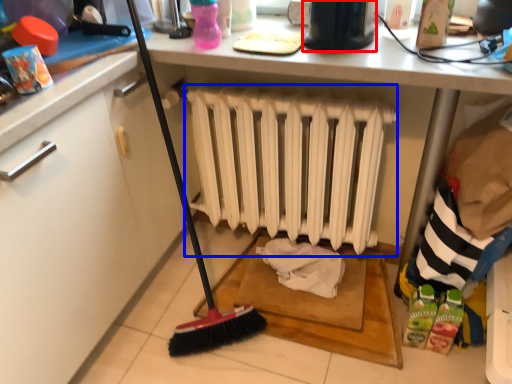
Question: Which of the following is the closest to the observer, appliance (highlighted by a red box) or radiator (highlighted by a blue box)?

Choices:
 (A) appliance
 (B) radiator

Answer: (A)